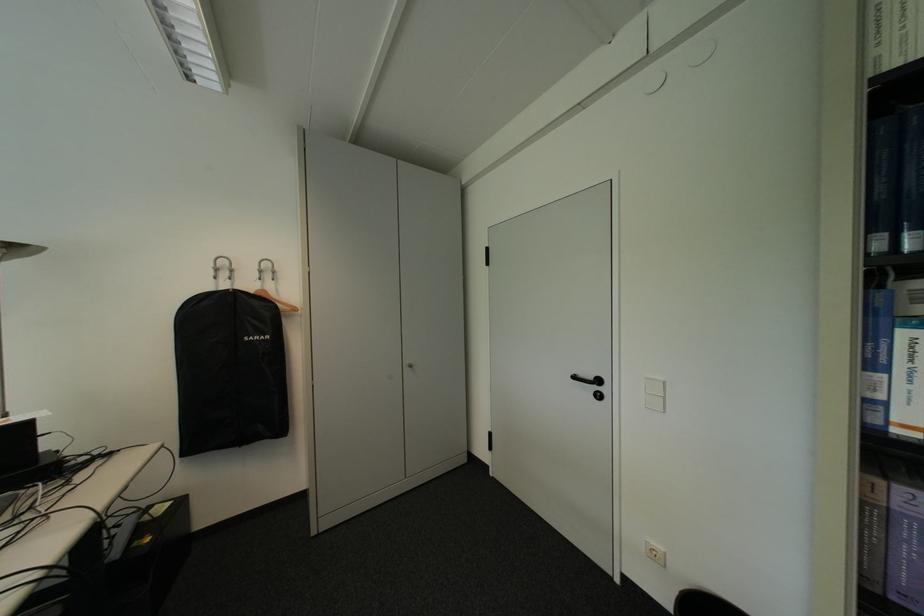
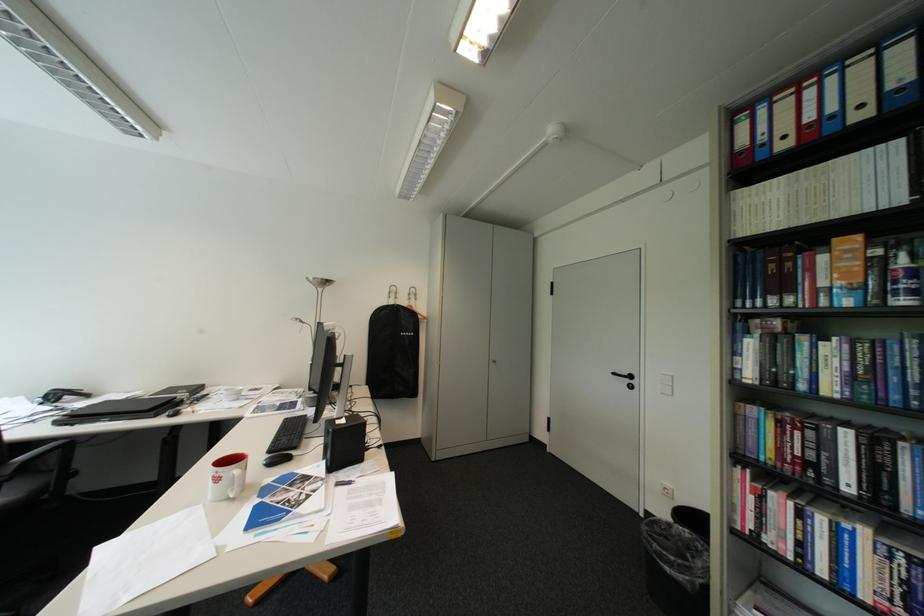
Find the pixel in the second image that matches point 419,370 in the first image.

(504, 363)